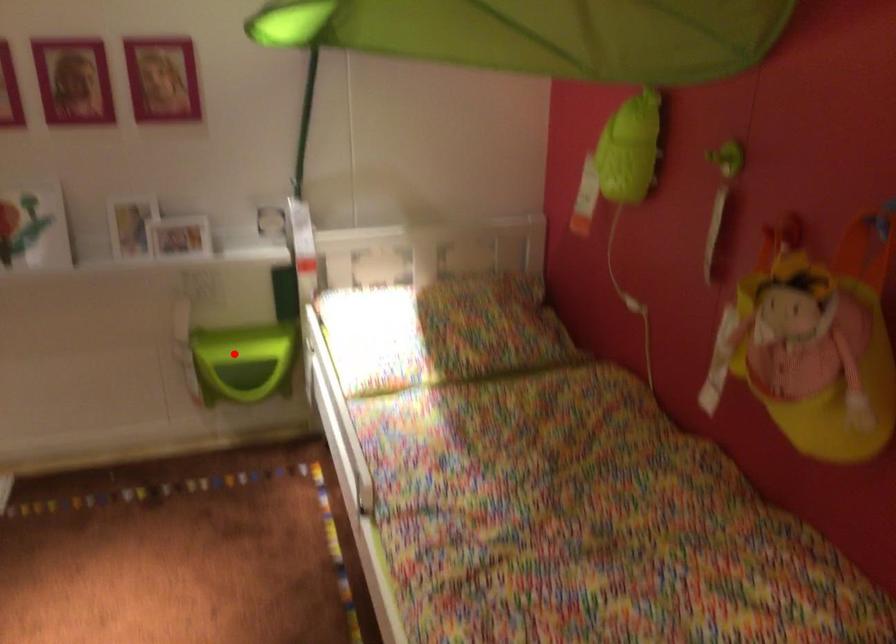
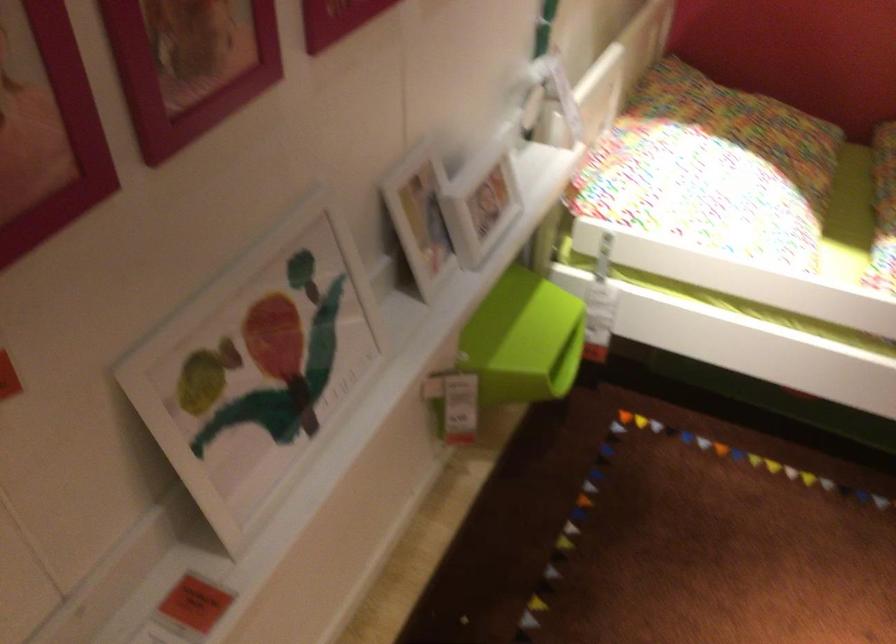
Question: I am providing you with two images of the same scene from different viewpoints. Given a red point in image1, look at the same physical point in image2. Is it:

Choices:
 (A) Closer to the viewpoint
 (B) Farther from the viewpoint

Answer: (A)